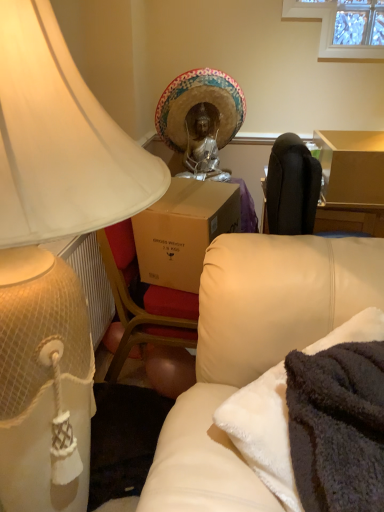
Question: Is soft cream leather couch at lower right behind matte white lampshade at left?

Choices:
 (A) no
 (B) yes

Answer: (B)

Question: Is matte white lampshade at left at the back of soft cream leather couch at lower right?

Choices:
 (A) no
 (B) yes

Answer: (A)

Question: Is soft cream leather couch at lower right at the right side of matte white lampshade at left?

Choices:
 (A) no
 (B) yes

Answer: (B)

Question: From the image's perspective, is soft cream leather couch at lower right located above matte white lampshade at left?

Choices:
 (A) no
 (B) yes

Answer: (A)

Question: Can you confirm if soft cream leather couch at lower right is thinner than matte white lampshade at left?

Choices:
 (A) no
 (B) yes

Answer: (B)

Question: Is gold textured headdress at center inside or outside of matte white lampshade at left?

Choices:
 (A) outside
 (B) inside

Answer: (A)

Question: From the image's perspective, is gold textured headdress at center positioned above or below matte white lampshade at left?

Choices:
 (A) below
 (B) above

Answer: (B)

Question: Is point (230, 123) positioned closer to the camera than point (49, 322)?

Choices:
 (A) farther
 (B) closer

Answer: (A)

Question: Considering the positions of gold textured headdress at center and matte white lampshade at left in the image, is gold textured headdress at center bigger or smaller than matte white lampshade at left?

Choices:
 (A) small
 (B) big

Answer: (A)

Question: Is matte white lampshade at left taller or shorter than gold textured headdress at center?

Choices:
 (A) short
 (B) tall

Answer: (B)

Question: Visually, is matte white lampshade at left positioned to the left or to the right of gold textured headdress at center?

Choices:
 (A) left
 (B) right

Answer: (A)

Question: Considering the positions of point (57, 102) and point (183, 130), is point (57, 102) closer or farther from the camera than point (183, 130)?

Choices:
 (A) farther
 (B) closer

Answer: (B)

Question: From the image's perspective, is matte white lampshade at left positioned above or below gold textured headdress at center?

Choices:
 (A) above
 (B) below

Answer: (B)

Question: Considering the positions of matte white lampshade at left and soft cream leather couch at lower right in the image, is matte white lampshade at left taller or shorter than soft cream leather couch at lower right?

Choices:
 (A) tall
 (B) short

Answer: (A)

Question: Considering the positions of matte white lampshade at left and soft cream leather couch at lower right in the image, is matte white lampshade at left bigger or smaller than soft cream leather couch at lower right?

Choices:
 (A) small
 (B) big

Answer: (B)